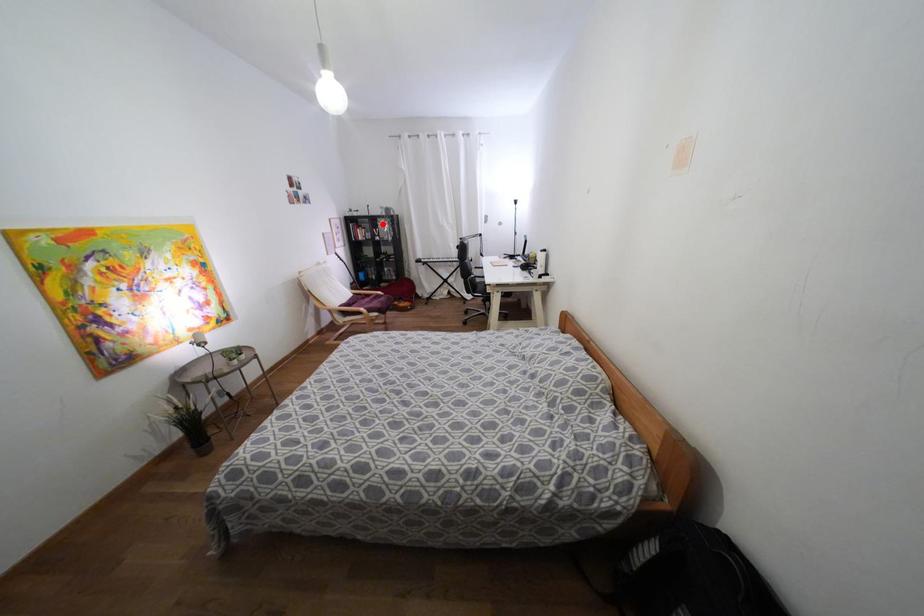
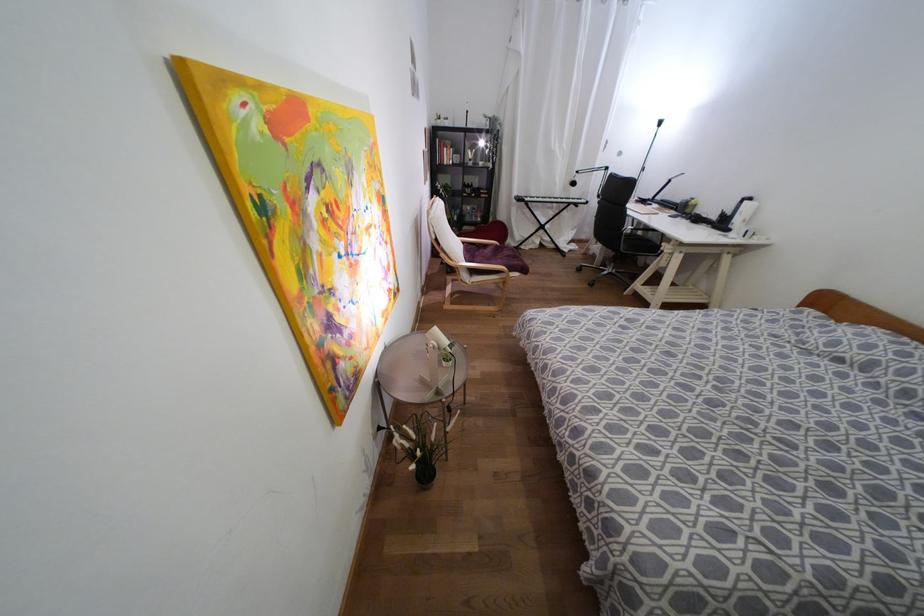
Locate, in the second image, the point that corresponds to the highlighted location in the first image.

(480, 143)